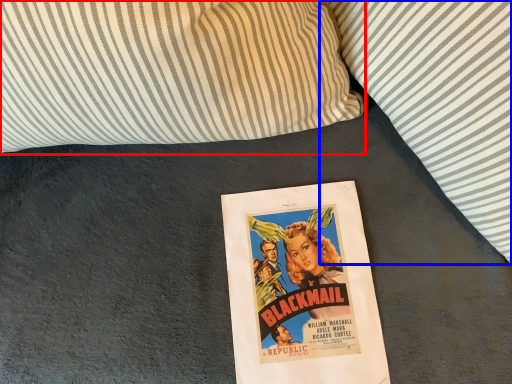
Question: Which object appears farthest to the camera in this image, pillow (highlighted by a red box) or pillow (highlighted by a blue box)?

Choices:
 (A) pillow
 (B) pillow

Answer: (A)